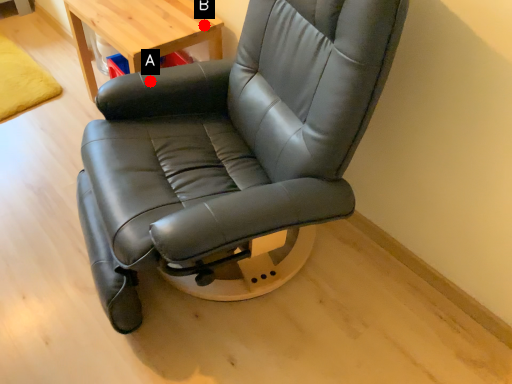
Question: Two points are circled on the image, labeled by A and B beside each circle. Which point is closer to the camera taking this photo?

Choices:
 (A) A is closer
 (B) B is closer

Answer: (A)